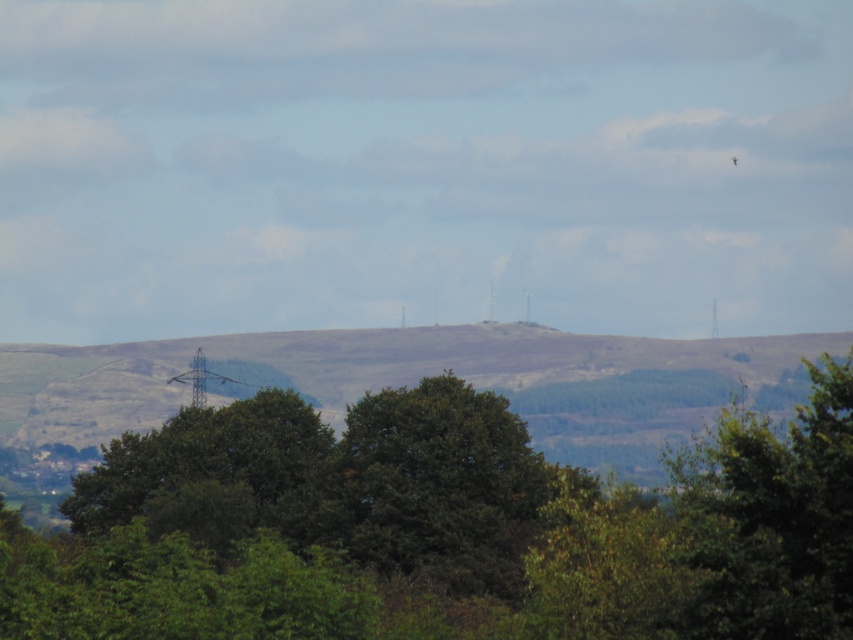
Question: Does green leafy tree at center have a greater width compared to green grassy hillside at center?

Choices:
 (A) yes
 (B) no

Answer: (B)

Question: Is green leafy tree at center behind green grassy hillside at center?

Choices:
 (A) yes
 (B) no

Answer: (B)

Question: From the image, what is the correct spatial relationship of green leafy tree at center in relation to green grassy hillside at center?

Choices:
 (A) above
 (B) below

Answer: (A)

Question: Which of the following is the farthest from the observer?

Choices:
 (A) (795, 352)
 (B) (299, 419)

Answer: (A)

Question: Among these objects, which one is farthest from the camera?

Choices:
 (A) green leafy tree at center
 (B) green grassy hillside at center

Answer: (B)